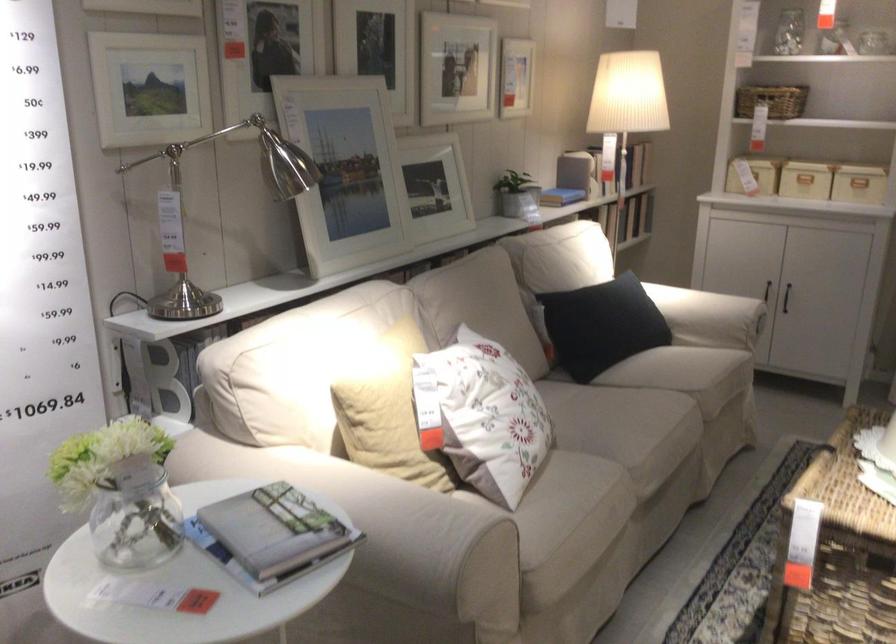
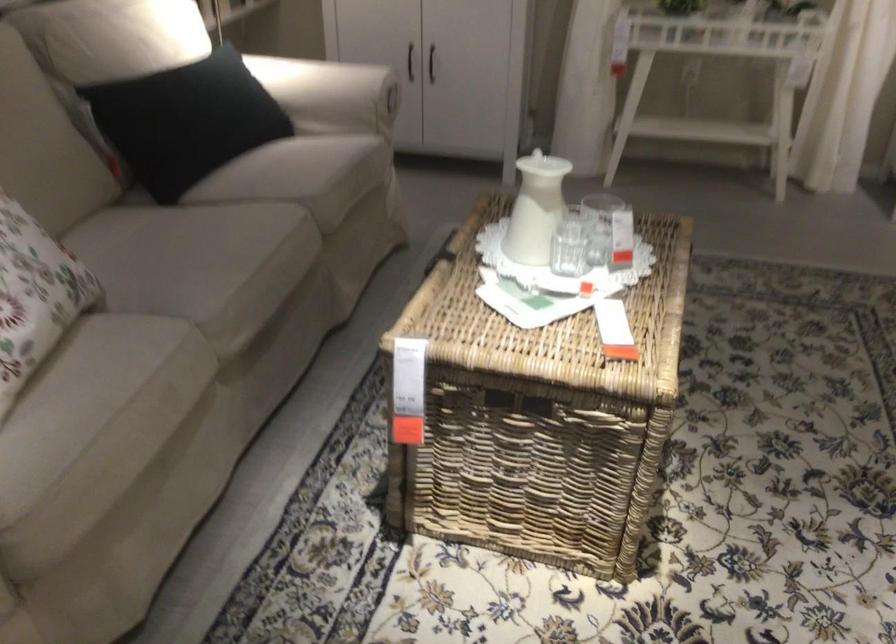
Question: How did the camera likely rotate?

Choices:
 (A) Left
 (B) Right
 (C) Up
 (D) Down

Answer: (B)